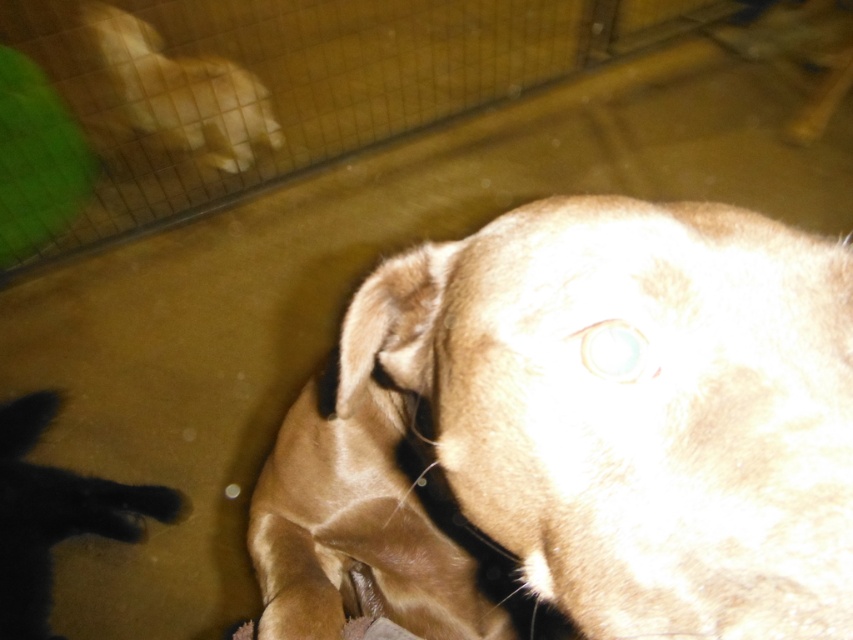
Can you confirm if fuzzy brown dog at center is positioned above fuzzy beige dog at upper left?

No.

Which is below, fuzzy brown dog at center or fuzzy beige dog at upper left?

fuzzy brown dog at center is lower down.

You are a GUI agent. You are given a task and a screenshot of the screen. Output one action in this format:
    pyautogui.click(x=<x>, y=<y>)
    Task: Click on the fuzzy brown dog at center
    The width and height of the screenshot is (853, 640).
    Given the screenshot: What is the action you would take?
    pyautogui.click(x=581, y=432)